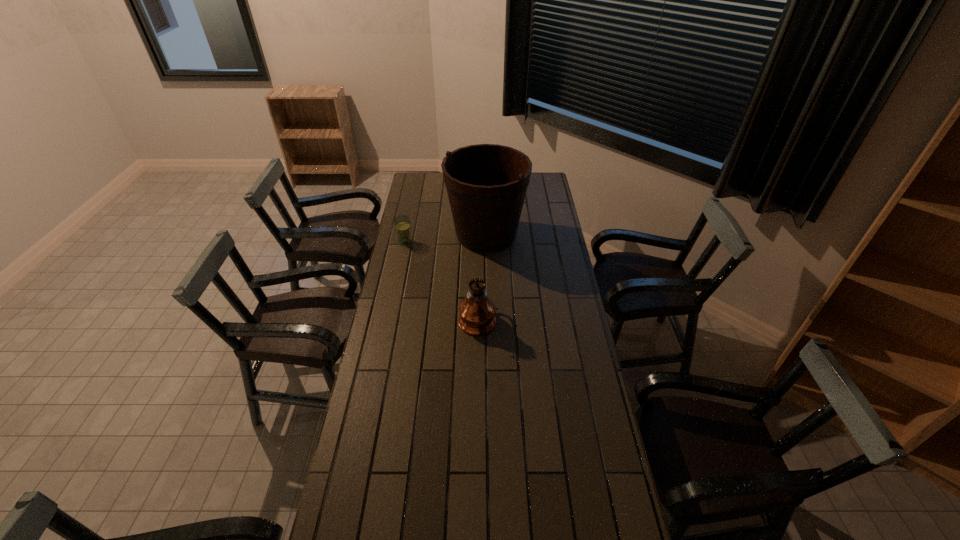
In the image, there is a desktop. Where is `free space at the right edge`? Image resolution: width=960 pixels, height=540 pixels. free space at the right edge is located at coordinates (589, 468).

The height and width of the screenshot is (540, 960). Identify the location of vacant space at the far right corner of the desktop. (534, 173).

In order to click on vacant space that is in between the nearest object and the shortest object in this screenshot , I will do `click(441, 280)`.

Find the location of a particular element. free space between the bucket and the glass is located at coordinates (445, 238).

Identify the location of free space between the oil lamp and the shortest object. This screenshot has width=960, height=540. (x=441, y=280).

Image resolution: width=960 pixels, height=540 pixels. In order to click on free space between the nearest object and the leftmost object in this screenshot , I will do `click(441, 280)`.

Where is `vacant area between the glass and the bucket`? vacant area between the glass and the bucket is located at coordinates (445, 238).

Where is `free space between the leftmost object and the oil lamp`? The width and height of the screenshot is (960, 540). free space between the leftmost object and the oil lamp is located at coordinates (x=441, y=280).

This screenshot has width=960, height=540. I want to click on free spot between the bucket and the shortest object, so click(445, 238).

Where is `vacant region between the glass and the bucket`? vacant region between the glass and the bucket is located at coordinates (445, 238).